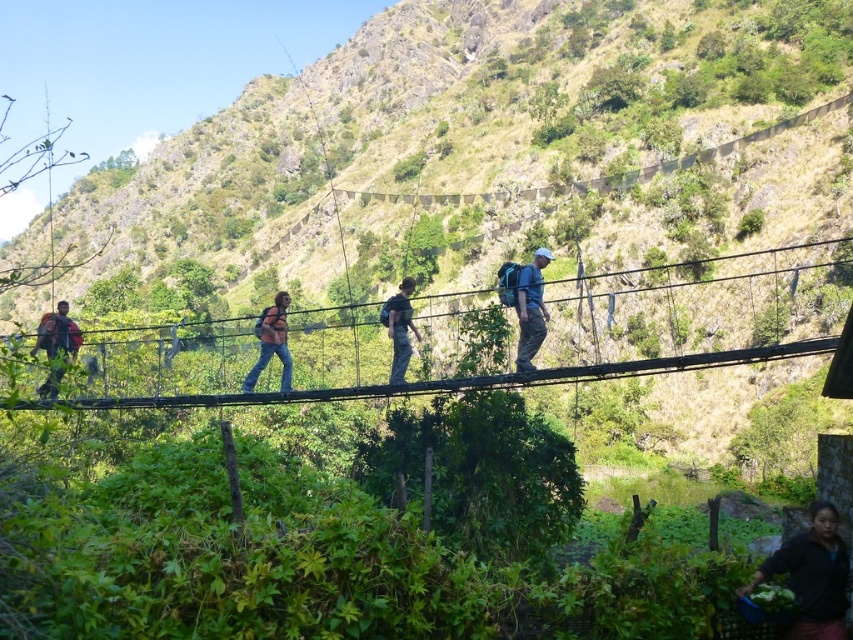
What is the 2D coordinate of the green grassy hillside at center in the image?

The green grassy hillside at center is located at the 2D coordinate point of (x=454, y=132).

You are a hiker trying to cross the black wire rope bridge at center. From your current position on the green grassy hillside at center, which direction should you move to reach the bridge?

The green grassy hillside at center is to the left of the black wire rope bridge at center, so you should move to the right to reach the bridge.